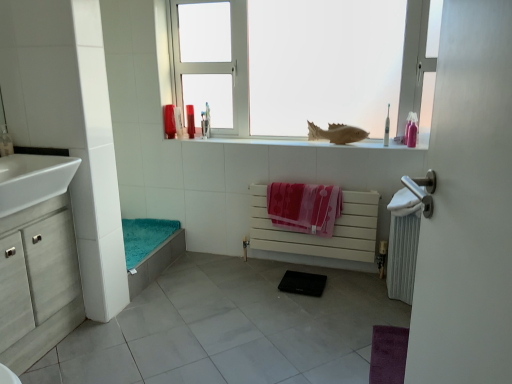
This screenshot has width=512, height=384. I want to click on free spot above gray tile at center (from a real-world perspective), so click(267, 327).